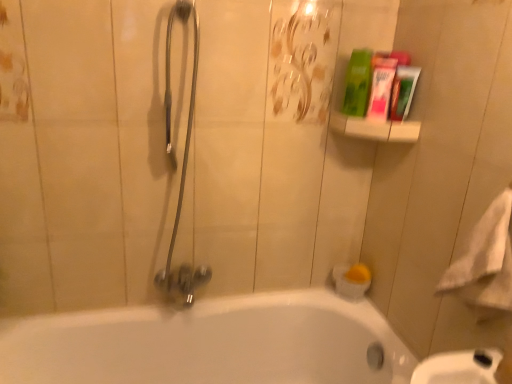
How much space does green matte tube at upper right, which is the 2th mouthwash from left to right, occupy vertically?

The height of green matte tube at upper right, which is the 2th mouthwash from left to right, is 6.05 inches.

Locate an element on the screen. The width and height of the screenshot is (512, 384). green matte tube at upper right, marked as the 1th mouthwash in a right-to-left arrangement is located at coordinates (403, 91).

What do you see at coordinates (358, 83) in the screenshot? I see `green matte box at upper right` at bounding box center [358, 83].

The height and width of the screenshot is (384, 512). What do you see at coordinates (375, 128) in the screenshot? I see `green plastic container at upper right` at bounding box center [375, 128].

The image size is (512, 384). In order to click on white soft towel at right in this screenshot , I will do `click(485, 261)`.

At what (x,y) coordinates should I click in order to perform the action: click on satin silver shower head at center left. Please return your answer as a coordinate pair (x, y). The height and width of the screenshot is (384, 512). Looking at the image, I should click on (182, 165).

I want to click on green matte tube at upper right, marked as the 1th mouthwash in a right-to-left arrangement, so click(x=403, y=91).

Between satin silver shower head at center left and green plastic container at upper right, which one has larger size?

satin silver shower head at center left is bigger.

In the image, is satin silver shower head at center left on the left side or the right side of green plastic container at upper right?

From the image, it's evident that satin silver shower head at center left is to the left of green plastic container at upper right.

Is satin silver shower head at center left facing away from green plastic container at upper right?

No, satin silver shower head at center left's orientation is not away from green plastic container at upper right.

Does point (195, 20) lie behind point (358, 134)?

No, it is not.

Considering the sizes of white glossy bathtub at lower center and green matte box at upper right in the image, is white glossy bathtub at lower center bigger or smaller than green matte box at upper right?

In the image, white glossy bathtub at lower center appears to be larger than green matte box at upper right.

Considering their positions, is white glossy bathtub at lower center located in front of or behind green matte box at upper right?

In the image, white glossy bathtub at lower center appears in front of green matte box at upper right.

Could you tell me if white glossy bathtub at lower center is turned towards green matte box at upper right?

No, white glossy bathtub at lower center is not turned towards green matte box at upper right.

Considering the sizes of objects satin silver shower head at center left and green matte tube at upper right, acting as the 2th mouthwash starting from the right, in the image provided, who is taller, satin silver shower head at center left or green matte tube at upper right, acting as the 2th mouthwash starting from the right,?

satin silver shower head at center left is taller.

Is satin silver shower head at center left bigger or smaller than green matte tube at upper right, acting as the 2th mouthwash starting from the right?

In the image, satin silver shower head at center left appears to be larger than green matte tube at upper right, acting as the 2th mouthwash starting from the right.

Does point (165, 113) come behind point (386, 99)?

Yes, it is.

You are a GUI agent. You are given a task and a screenshot of the screen. Output one action in this format:
    pyautogui.click(x=<x>, y=<y>)
    Task: Click on the shower in front of the green matte tube at upper right, acting as the 2th mouthwash starting from the right
    
    Given the screenshot: What is the action you would take?
    182,165

Which object is further away from the camera taking this photo, white soft towel at right or satin silver shower head at center left?

satin silver shower head at center left is further from the camera.

Between point (475, 226) and point (169, 274), which one is positioned in front?

The point (475, 226) is in front.

Would you say white soft towel at right is to the left or to the right of satin silver shower head at center left in the picture?

From the image, it's evident that white soft towel at right is to the right of satin silver shower head at center left.

This screenshot has width=512, height=384. In order to click on shower behind the white soft towel at right in this screenshot , I will do `click(182, 165)`.

Consider the image. In terms of width, does green plastic container at upper right look wider or thinner when compared to green matte tube at upper right, the 1th mouthwash when ordered from left to right?

green plastic container at upper right is wider than green matte tube at upper right, the 1th mouthwash when ordered from left to right.

Are green plastic container at upper right and green matte tube at upper right, acting as the 2th mouthwash starting from the right, beside each other?

Yes, green plastic container at upper right is in contact with green matte tube at upper right, acting as the 2th mouthwash starting from the right.

From a real-world perspective, starting from the green plastic container at upper right, which mouthwash is the 1st one vertically above it? Please provide its 2D coordinates.

[(381, 88)]

From the image's perspective, is white glossy bathtub at lower center under satin silver shower head at center left?

Correct, white glossy bathtub at lower center appears lower than satin silver shower head at center left in the image.

Is white glossy bathtub at lower center inside or outside of satin silver shower head at center left?

white glossy bathtub at lower center cannot be found inside satin silver shower head at center left.

Which of these two, white glossy bathtub at lower center or satin silver shower head at center left, is thinner?

satin silver shower head at center left is thinner.

Considering the points (318, 308) and (495, 212), which point is behind, point (318, 308) or point (495, 212)?

The point (318, 308) is farther from the camera.

From the image's perspective, is white glossy bathtub at lower center below white soft towel at right?

Indeed, from the image's perspective, white glossy bathtub at lower center is shown beneath white soft towel at right.

Is white glossy bathtub at lower center directly adjacent to white soft towel at right?

No, white glossy bathtub at lower center is not making contact with white soft towel at right.

Do you think white glossy bathtub at lower center is within white soft towel at right, or outside of it?

white glossy bathtub at lower center is not inside white soft towel at right, it's outside.

In the image, there is a satin silver shower head at center left. What are the coordinates of `balustrade above it (from the image's perspective)` in the screenshot? It's located at (375, 128).

In order to click on cleaning product on the right side of white glossy bathtub at lower center in this screenshot , I will do `click(358, 83)`.

Estimate the real-world distances between objects in this image. Which object is further from satin silver shower head at center left, green matte box at upper right or white soft towel at right?

white soft towel at right is further to satin silver shower head at center left.

Which object lies nearer to the anchor point white soft towel at right, green matte tube at upper right, acting as the 2th mouthwash starting from the right, or green plastic container at upper right?

The object closer to white soft towel at right is green plastic container at upper right.

When comparing their distances from white soft towel at right, does green plastic container at upper right or green matte box at upper right seem closer?

Among the two, green plastic container at upper right is located nearer to white soft towel at right.

When comparing their distances from white soft towel at right, does satin silver shower head at center left or green matte tube at upper right, which is the 2th mouthwash from left to right, seem further?

satin silver shower head at center left is positioned further to the anchor white soft towel at right.

Which object lies further to the anchor point satin silver shower head at center left, green matte tube at upper right, which is the 2th mouthwash from left to right, or white glossy bathtub at lower center?

green matte tube at upper right, which is the 2th mouthwash from left to right.

From the image, which object appears to be nearer to green matte tube at upper right, the 1th mouthwash when ordered from left to right, satin silver shower head at center left or green matte tube at upper right, marked as the 1th mouthwash in a right-to-left arrangement?

green matte tube at upper right, marked as the 1th mouthwash in a right-to-left arrangement, is closer to green matte tube at upper right, the 1th mouthwash when ordered from left to right.

Based on their spatial positions, is green matte tube at upper right, acting as the 2th mouthwash starting from the right, or green matte box at upper right further from green matte tube at upper right, marked as the 1th mouthwash in a right-to-left arrangement?

The object further to green matte tube at upper right, marked as the 1th mouthwash in a right-to-left arrangement, is green matte box at upper right.

Based on their spatial positions, is white glossy bathtub at lower center or green matte tube at upper right, the 1th mouthwash when ordered from left to right, closer to green matte box at upper right?

green matte tube at upper right, the 1th mouthwash when ordered from left to right.

Identify the location of cleaning product between satin silver shower head at center left and white soft towel at right from left to right. The image size is (512, 384). (358, 83).

Find the location of a particular element. cleaning product situated between satin silver shower head at center left and green plastic container at upper right from left to right is located at coordinates (358, 83).

The width and height of the screenshot is (512, 384). I want to click on balustrade located between green matte box at upper right and green matte tube at upper right, marked as the 1th mouthwash in a right-to-left arrangement, in the left-right direction, so click(x=375, y=128).

Where is `balustrade situated between satin silver shower head at center left and green matte tube at upper right, acting as the 2th mouthwash starting from the right, from left to right`? balustrade situated between satin silver shower head at center left and green matte tube at upper right, acting as the 2th mouthwash starting from the right, from left to right is located at coordinates (375, 128).